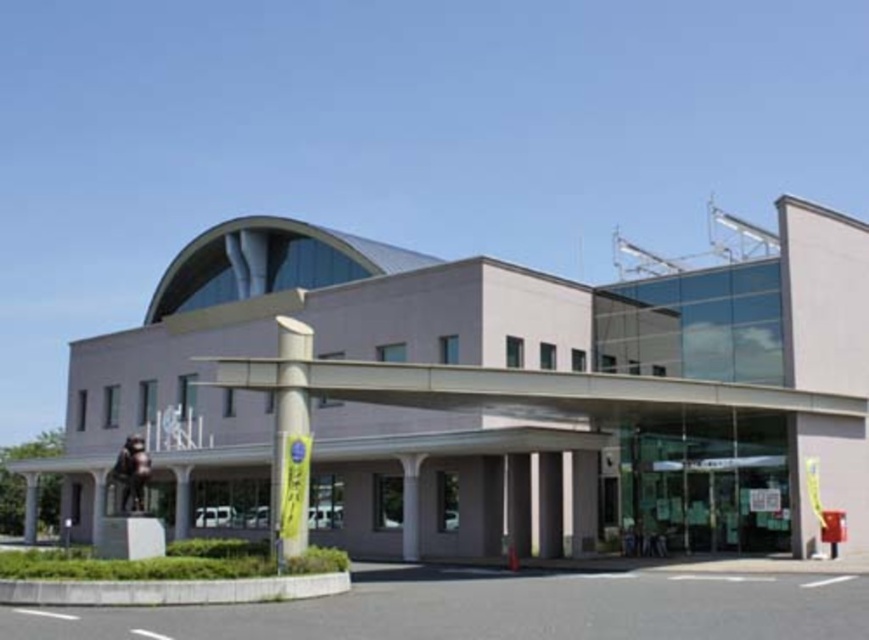
Question: Among these points, which one is nearest to the camera?

Choices:
 (A) (403, 522)
 (B) (34, 525)
 (C) (184, 524)

Answer: (A)

Question: Does smooth concrete pillar at center appear over gray concrete pillar at lower left?

Choices:
 (A) yes
 (B) no

Answer: (A)

Question: Can you confirm if white smooth column at center is wider than smooth concrete pillar at center?

Choices:
 (A) no
 (B) yes

Answer: (A)

Question: Which point is farther from the camera taking this photo?

Choices:
 (A) (183, 502)
 (B) (292, 396)
 (C) (35, 524)

Answer: (C)

Question: Is white smooth column at center smaller than smooth concrete pillar at center?

Choices:
 (A) yes
 (B) no

Answer: (A)

Question: Which of the following is the farthest from the observer?

Choices:
 (A) (27, 484)
 (B) (180, 492)

Answer: (A)